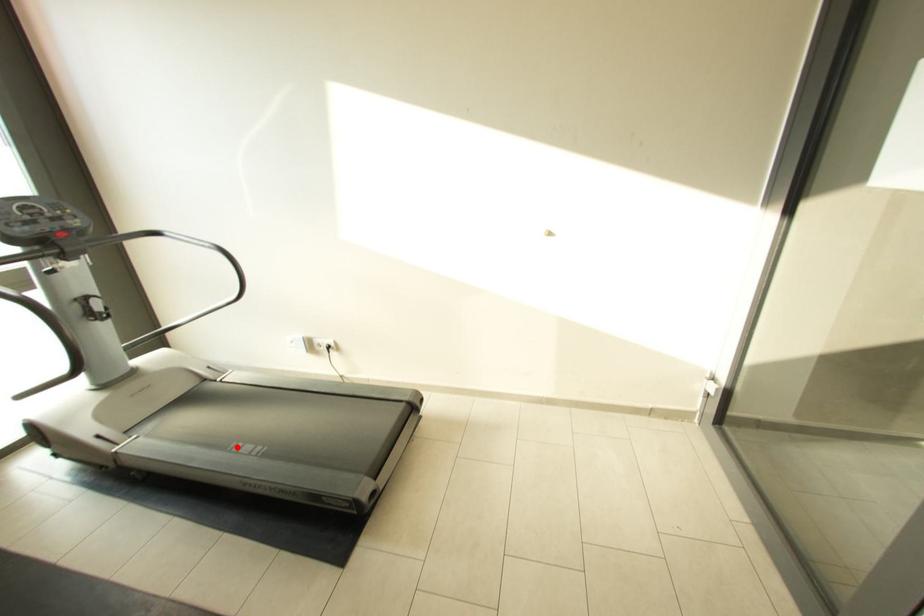
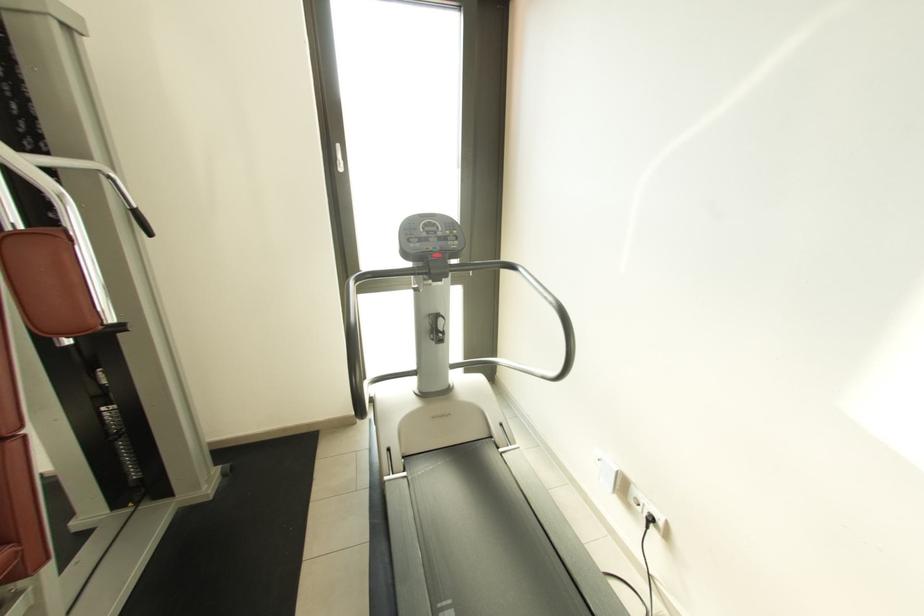
Find the pixel in the second image that matches the highlighted location in the first image.

(450, 605)